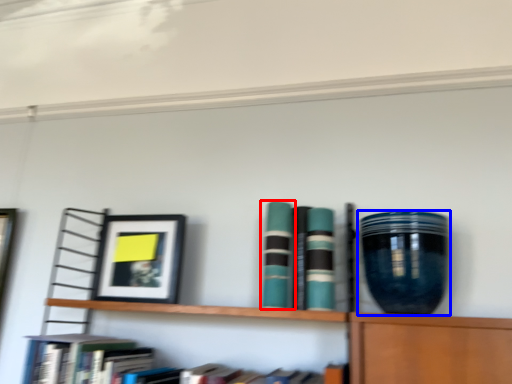
Question: Which object appears farthest to the camera in this image, book (highlighted by a red box) or vase (highlighted by a blue box)?

Choices:
 (A) book
 (B) vase

Answer: (A)